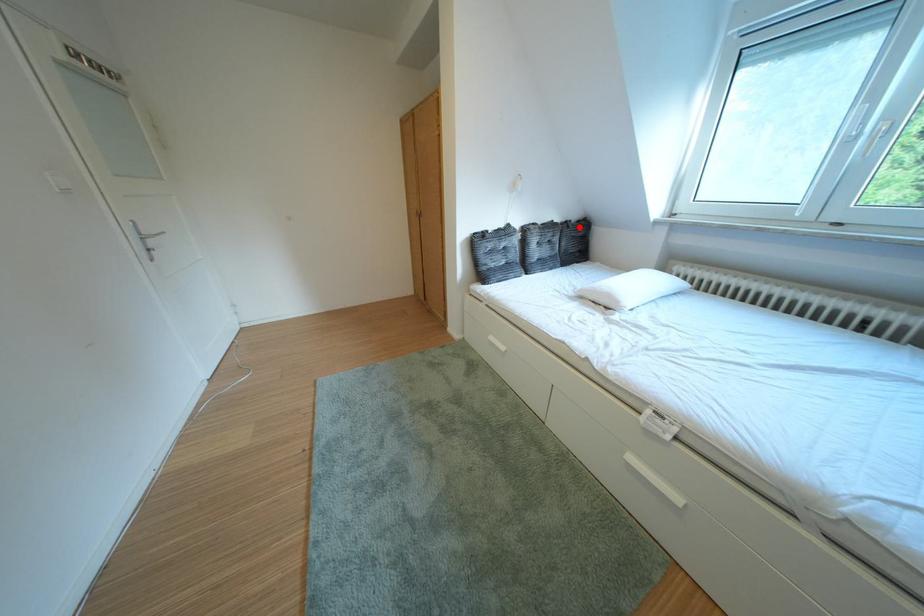
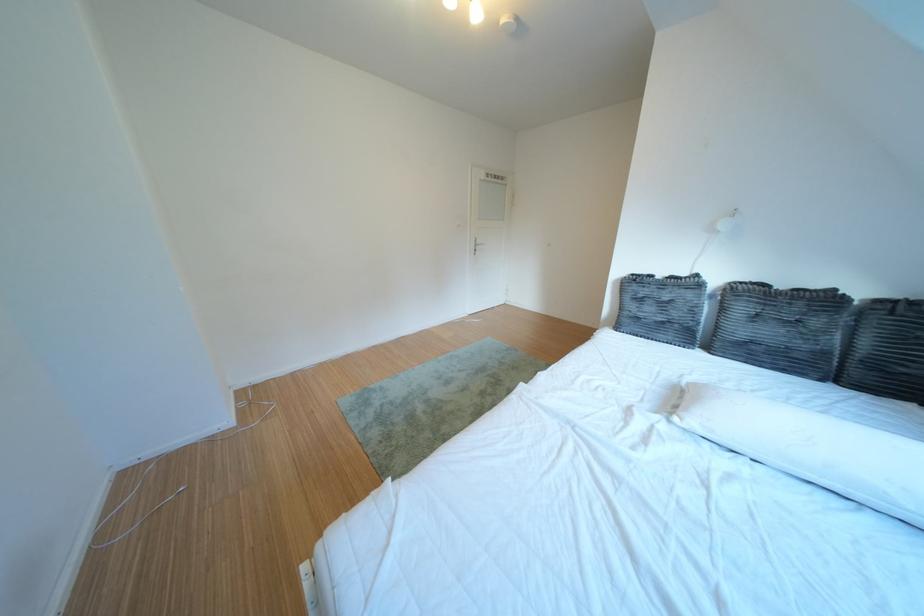
Question: I am providing you with two images of the same scene from different viewpoints. In image1, a red point is highlighted. Considering the same 3D point in image2, which of the following is correct?

Choices:
 (A) It is closer
 (B) It is farther

Answer: (B)